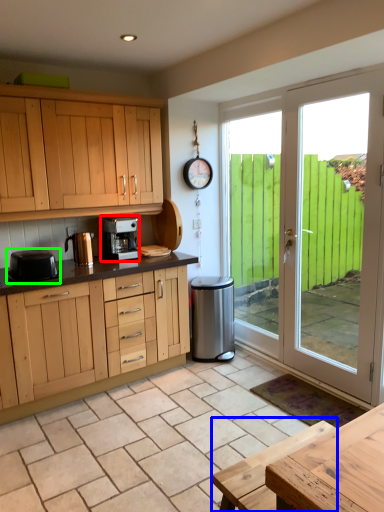
Question: Based on their relative distances, which object is nearer to kitchen appliance (highlighted by a red box)? Choose from table (highlighted by a blue box) and kitchen appliance (highlighted by a green box).

Choices:
 (A) table
 (B) kitchen appliance

Answer: (B)